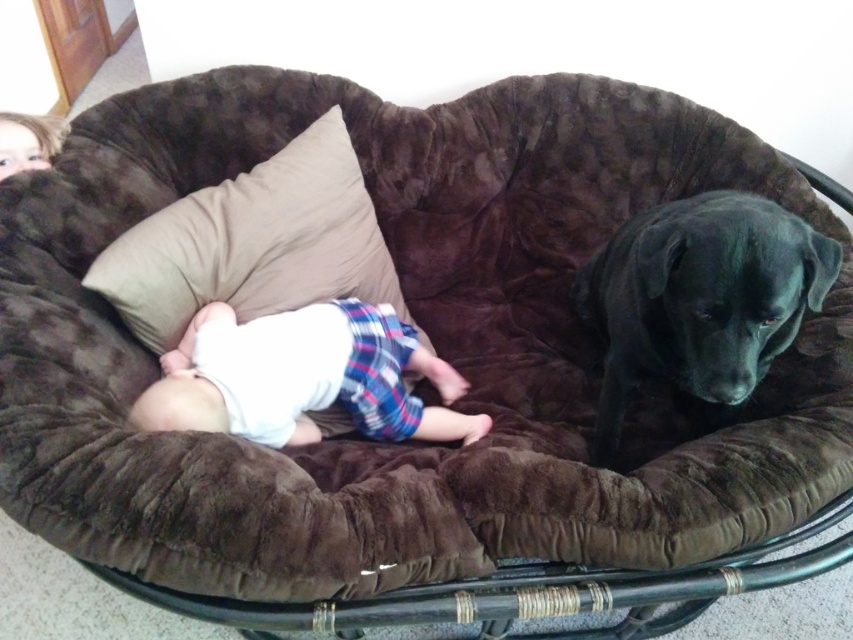
You are a parent trying to place a baby monitor on the bed. The monitor requires a space of 10 inches. Can the monitor be placed between the black velvet dog at upper right and the beige fabric pillow at center?

The distance between the black velvet dog at upper right and the beige fabric pillow at center is 22.96 inches, which is more than enough to place the baby monitor requiring 10 inches of space between them.

You are a delivery robot that is 1 meter tall. You need to place a package on the bed. The point where you need to place it is at coordinates point (631, 314). What is the minimum height you need to lift the package to reach that point?

The minimum height you need to lift the package to reach the point (631, 314) is 1.28 meters, as that is the distance from the camera to the point.